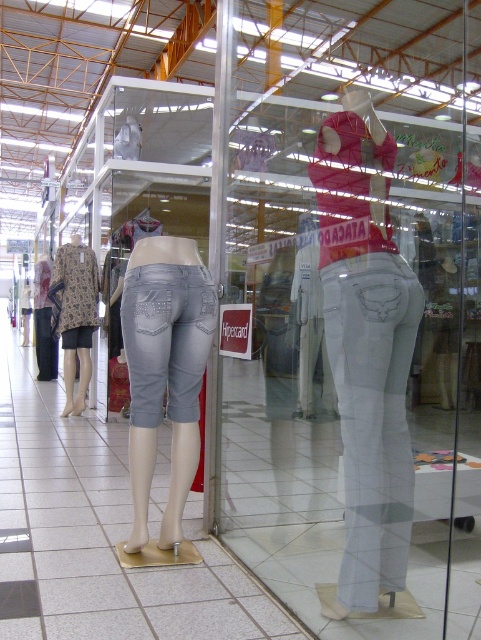
Question: Which is farther from the denim jeans at center?

Choices:
 (A) white denim jeans at center
 (B) denim/cuffed pants at center

Answer: (A)

Question: Which object appears farthest from the camera in this image?

Choices:
 (A) patterned fabric dress at left
 (B) denim jeans at center
 (C) white denim jeans at center
 (D) denim/cuffed pants at center

Answer: (A)

Question: Which object is the closest to the patterned fabric dress at left?

Choices:
 (A) denim/cuffed pants at center
 (B) denim jeans at center
 (C) white denim pants at center
 (D) white denim jeans at center

Answer: (B)

Question: Can you confirm if white denim pants at center is positioned above denim/cuffed pants at center?

Choices:
 (A) yes
 (B) no

Answer: (A)

Question: Can you confirm if denim jeans at center is positioned to the right of patterned fabric dress at left?

Choices:
 (A) no
 (B) yes

Answer: (B)

Question: Can you confirm if white denim pants at center is positioned to the right of patterned fabric dress at left?

Choices:
 (A) yes
 (B) no

Answer: (A)